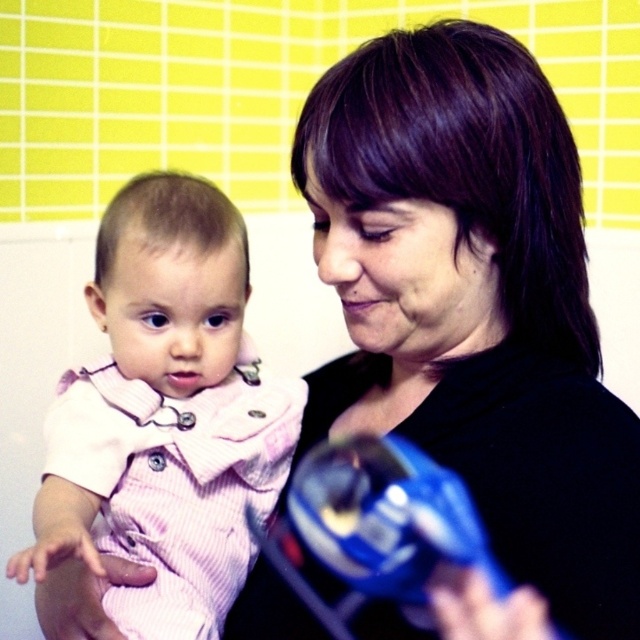
Question: Does black matte hair at center appear over pink striped fabric at left?

Choices:
 (A) yes
 (B) no

Answer: (A)

Question: Does black matte hair at center have a larger size compared to pink striped fabric at left?

Choices:
 (A) no
 (B) yes

Answer: (B)

Question: Which object appears closest to the camera in this image?

Choices:
 (A) pink striped fabric at left
 (B) black matte hair at center

Answer: (A)

Question: Does black matte hair at center have a larger size compared to pink striped fabric at left?

Choices:
 (A) no
 (B) yes

Answer: (B)